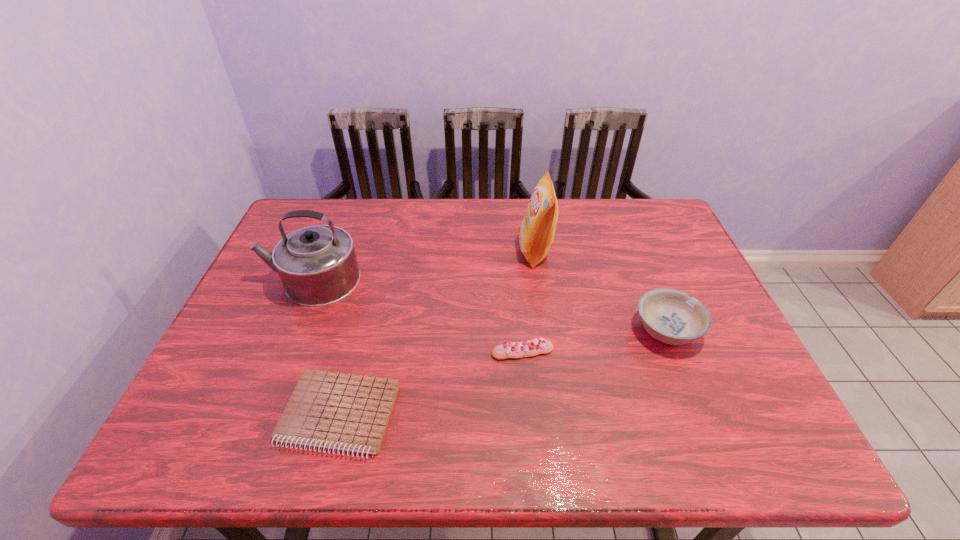
Locate an element on the screen. The width and height of the screenshot is (960, 540). free location located on the left of the third shortest object is located at coordinates (522, 330).

This screenshot has width=960, height=540. In order to click on free space located 0.340m on the back of the eclair in this screenshot , I will do `click(514, 253)`.

Identify the location of vacant position located 0.200m on the left of the shortest object. The width and height of the screenshot is (960, 540). (190, 415).

Where is `object positioned at the far edge`? Image resolution: width=960 pixels, height=540 pixels. object positioned at the far edge is located at coordinates (536, 232).

Locate an element on the screen. object that is at the near edge is located at coordinates (346, 412).

Image resolution: width=960 pixels, height=540 pixels. What are the coordinates of `object at the left edge` in the screenshot? It's located at (317, 265).

You are a GUI agent. You are given a task and a screenshot of the screen. Output one action in this format:
    pyautogui.click(x=<x>, y=<y>)
    Task: Click on the object located at the right edge
    Image resolution: width=960 pixels, height=540 pixels.
    Given the screenshot: What is the action you would take?
    pyautogui.click(x=671, y=316)

You are a GUI agent. You are given a task and a screenshot of the screen. Output one action in this format:
    pyautogui.click(x=<x>, y=<y>)
    Task: Click on the vacant space at the far edge of the desktop
    The height and width of the screenshot is (540, 960).
    Given the screenshot: What is the action you would take?
    pyautogui.click(x=494, y=213)

Locate an element on the screen. vacant space at the left edge of the desktop is located at coordinates (243, 388).

The height and width of the screenshot is (540, 960). Find the location of `free space at the right edge`. free space at the right edge is located at coordinates (640, 242).